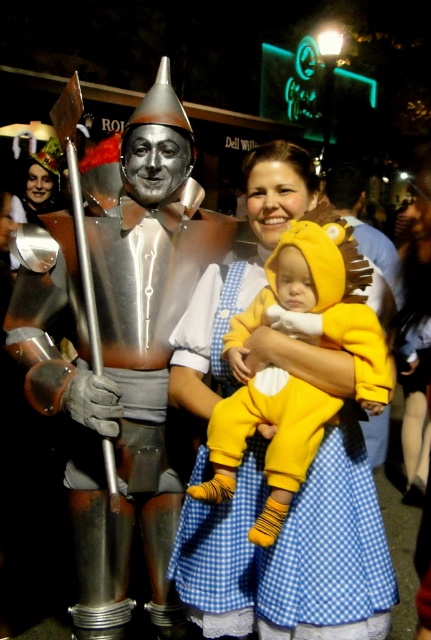
Question: Does shiny silver armor at center come in front of soft yellow plush at center?

Choices:
 (A) no
 (B) yes

Answer: (A)

Question: Can you confirm if shiny silver armor at center is positioned above soft yellow plush at center?

Choices:
 (A) no
 (B) yes

Answer: (B)

Question: Can you confirm if shiny silver armor at center is bigger than soft yellow plush at center?

Choices:
 (A) no
 (B) yes

Answer: (B)

Question: Among these objects, which one is nearest to the camera?

Choices:
 (A) shiny silver armor at center
 (B) soft yellow plush at center

Answer: (B)